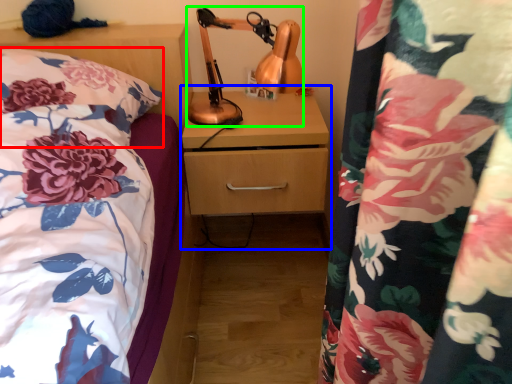
Question: Estimate the real-world distances between objects in this image. Which object is closer to pillow (highlighted by a red box), dresser (highlighted by a blue box) or table lamp (highlighted by a green box)?

Choices:
 (A) dresser
 (B) table lamp

Answer: (B)